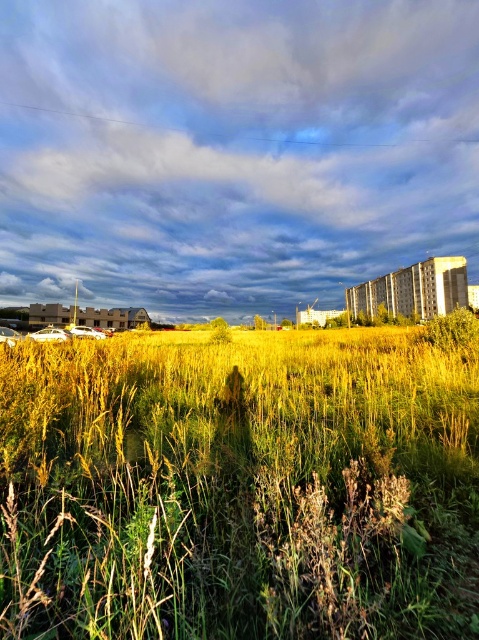
Question: Considering the relative positions of yellow grass at center and cloudy sky at upper center in the image provided, where is yellow grass at center located with respect to cloudy sky at upper center?

Choices:
 (A) below
 (B) above

Answer: (A)

Question: Does yellow grass at center appear on the left side of cloudy sky at upper center?

Choices:
 (A) yes
 (B) no

Answer: (B)

Question: Can you confirm if yellow grass at center is positioned above cloudy sky at upper center?

Choices:
 (A) yes
 (B) no

Answer: (B)

Question: Among these objects, which one is nearest to the camera?

Choices:
 (A) yellow grass at center
 (B) cloudy sky at upper center

Answer: (A)